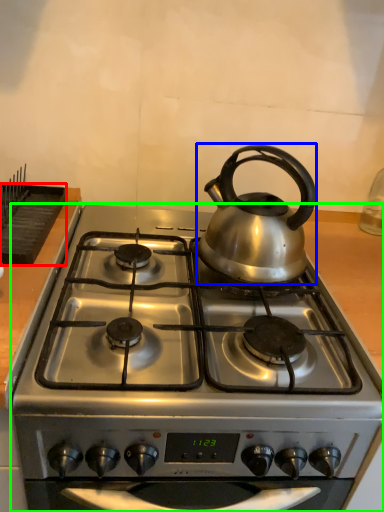
Question: Which object is positioned farthest from kitchen appliance (highlighted by a red box)? Select from kettle (highlighted by a blue box) and gas stove (highlighted by a green box).

Choices:
 (A) kettle
 (B) gas stove

Answer: (A)